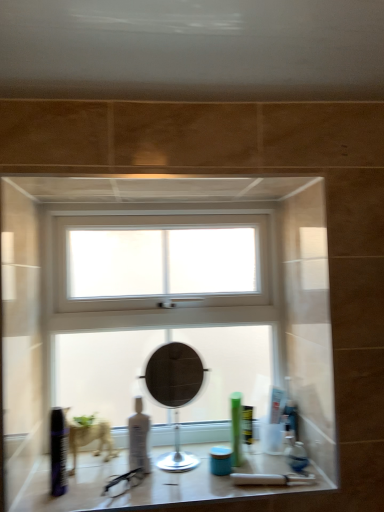
Question: Do you think matte glass counter top at center is within blue matte jar at center, which is the second toiletry from right to left, or outside of it?

Choices:
 (A) inside
 (B) outside

Answer: (B)

Question: In the image, is matte glass counter top at center on the left side or the right side of blue matte jar at center, the third toiletry from the left?

Choices:
 (A) left
 (B) right

Answer: (A)

Question: Estimate the real-world distances between objects in this image. Which object is closer to the green matte tube at center, the fourth toiletry in the left-to-right sequence?

Choices:
 (A) matte black mirror at center
 (B) clear glass window at center
 (C) matte glass counter top at center
 (D) transparent plastic bottle at center, which is the third toiletry from right to left
 (E) shiny black can at lower left, positioned as the first toiletry in left-to-right order

Answer: (A)

Question: Based on their relative distances, which object is nearer to the blue matte jar at center, which is the second toiletry from right to left?

Choices:
 (A) green matte tube at center, the fourth toiletry in the left-to-right sequence
 (B) matte glass counter top at center
 (C) matte black mirror at center
 (D) shiny black can at lower left, positioned as the first toiletry in left-to-right order
 (E) transparent plastic bottle at center, which is the third toiletry from right to left

Answer: (A)